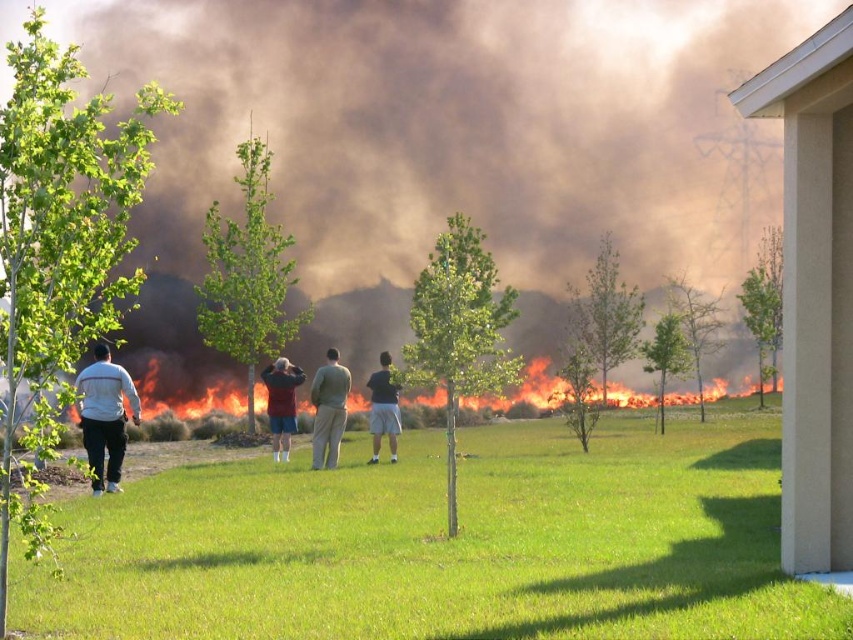
You are a firefighter assessing the scene. You see the brown smoke at center and the dark gray shorts at center. Which object is higher in elevation?

The brown smoke at center is taller than dark gray shorts at center, so the brown smoke at center is higher in elevation.

You are a firefighter trying to reach the fire in the background. You see the white matte pants at left and the maroon fabric shirt at center. Which person should you approach first to get information about the fire?

You should approach the white matte pants at left first because they are in front of the maroon fabric shirt at center, meaning they are closer to you and the fire.